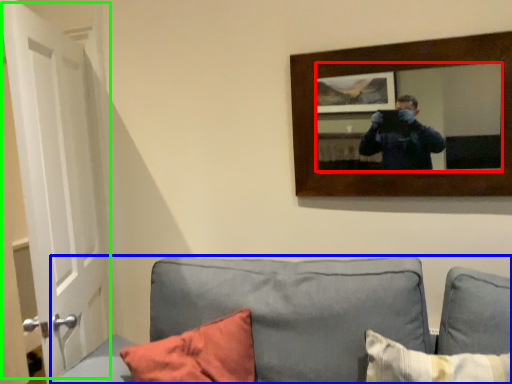
Question: Which is nearer to the mirror (highlighted by a red box)? studio couch (highlighted by a blue box) or door (highlighted by a green box).

Choices:
 (A) studio couch
 (B) door

Answer: (A)